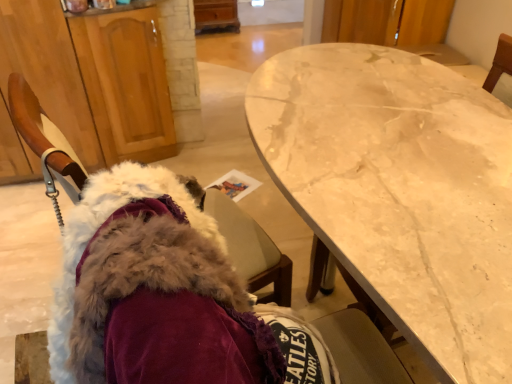
Where is `wooden cabinet at left`? The image size is (512, 384). wooden cabinet at left is located at coordinates (93, 78).

The height and width of the screenshot is (384, 512). I want to click on white marble table at center, so click(400, 190).

Is point (254, 273) closer or farther from the camera than point (323, 127)?

Point (254, 273) appears to be farther away from the viewer than point (323, 127).

Find the location of a particular element. desk that is under the fuzzy fabric chair at left (from a real-world perspective) is located at coordinates (400, 190).

From the image's perspective, between fuzzy fabric chair at left and white marble table at center, who is located below?

From the image's view, fuzzy fabric chair at left is below.

Does fuzzy fabric chair at left contain white marble table at center?

Definitely not — white marble table at center is not inside fuzzy fabric chair at left.

Does fuzzy fabric chair at left come in front of wooden cabinet at left?

That is True.

Between point (267, 274) and point (69, 109), which one is positioned behind?

Positioned behind is point (69, 109).

Can you confirm if fuzzy fabric chair at left is positioned to the left of wooden cabinet at left?

No, fuzzy fabric chair at left is not to the left of wooden cabinet at left.

Does fuzzy fabric chair at left have a greater height compared to wooden cabinet at left?

No.

Would you consider white marble table at center to be distant from wooden cabinet at left?

Yes, white marble table at center and wooden cabinet at left are quite far apart.

Is wooden cabinet at left located within white marble table at center?

No, white marble table at center does not contain wooden cabinet at left.

Which of these two, white marble table at center or wooden cabinet at left, stands taller?

white marble table at center is taller.

Is white marble table at center oriented towards fuzzy fabric chair at left?

Yes, white marble table at center is facing fuzzy fabric chair at left.

I want to click on desk on the right of the fuzzy fabric chair at left, so click(x=400, y=190).

Considering the relative sizes of white marble table at center and fuzzy fabric chair at left in the image provided, is white marble table at center shorter than fuzzy fabric chair at left?

No, white marble table at center is not shorter than fuzzy fabric chair at left.

Consider the image. Can you confirm if wooden cabinet at left is wider than white marble table at center?

In fact, wooden cabinet at left might be narrower than white marble table at center.

Between point (130, 135) and point (481, 130), which one is positioned in front?

Positioned in front is point (481, 130).

From the image's perspective, is wooden cabinet at left on white marble table at center?

Correct, wooden cabinet at left appears higher than white marble table at center in the image.

Considering the positions of objects wooden cabinet at left and white marble table at center in the image provided, who is more to the left, wooden cabinet at left or white marble table at center?

wooden cabinet at left.

Is wooden cabinet at left taller than fuzzy fabric chair at left?

Yes.

Is wooden cabinet at left spatially inside fuzzy fabric chair at left, or outside of it?

wooden cabinet at left cannot be found inside fuzzy fabric chair at left.

Between wooden cabinet at left and fuzzy fabric chair at left, which one has smaller width?

wooden cabinet at left.

Could you tell me if wooden cabinet at left is turned towards fuzzy fabric chair at left?

Yes, wooden cabinet at left is facing fuzzy fabric chair at left.

This screenshot has height=384, width=512. In order to click on chair lying on the left of white marble table at center in this screenshot , I will do `click(251, 248)`.

The height and width of the screenshot is (384, 512). In order to click on chair on the right of wooden cabinet at left in this screenshot , I will do `click(251, 248)`.

Looking at the image, which one is located closer to wooden cabinet at left, white marble table at center or fuzzy fabric chair at left?

fuzzy fabric chair at left is closer to wooden cabinet at left.

Consider the image. Which object lies nearer to the anchor point fuzzy fabric chair at left, wooden cabinet at left or white marble table at center?

white marble table at center is closer to fuzzy fabric chair at left.

Based on their spatial positions, is fuzzy fabric chair at left or white marble table at center further from wooden cabinet at left?

Based on the image, white marble table at center appears to be further to wooden cabinet at left.

Looking at the image, which one is located closer to fuzzy fabric chair at left, white marble table at center or wooden cabinet at left?

Among the two, white marble table at center is located nearer to fuzzy fabric chair at left.

When comparing their distances from white marble table at center, does fuzzy fabric chair at left or wooden cabinet at left seem closer?

Based on the image, fuzzy fabric chair at left appears to be nearer to white marble table at center.

Considering their positions, is wooden cabinet at left positioned closer to white marble table at center than fuzzy fabric chair at left?

Among the two, fuzzy fabric chair at left is located nearer to white marble table at center.

Locate an element on the screen. The image size is (512, 384). desk positioned between fuzzy fabric chair at left and wooden cabinet at left from near to far is located at coordinates (400, 190).